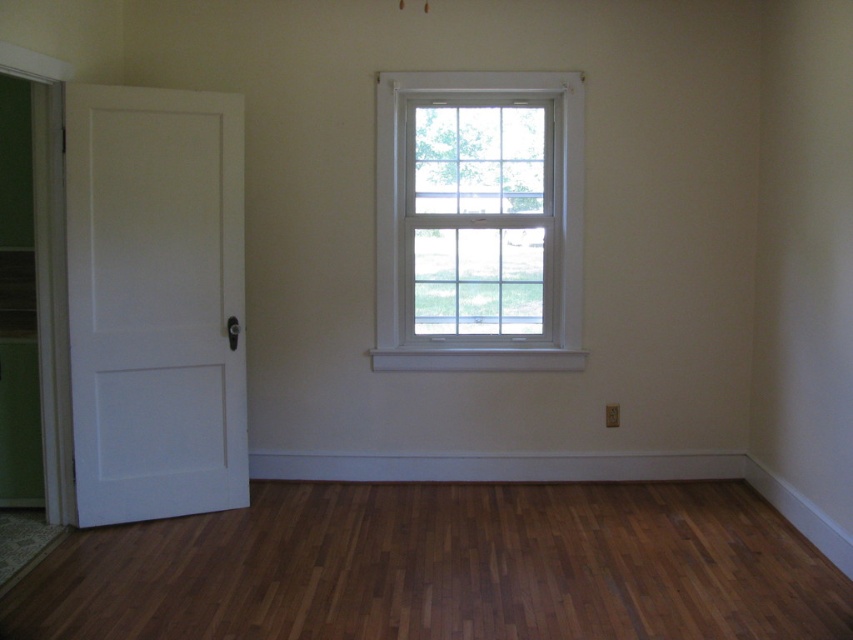
You are standing in the room and want to exit through the white matte door at left. Which direction should you move relative to the shiny brown hardwood floor at lower center?

You should move upward from the shiny brown hardwood floor at lower center to reach the white matte door at left since the shiny brown hardwood floor at lower center is located below the white matte door at left.